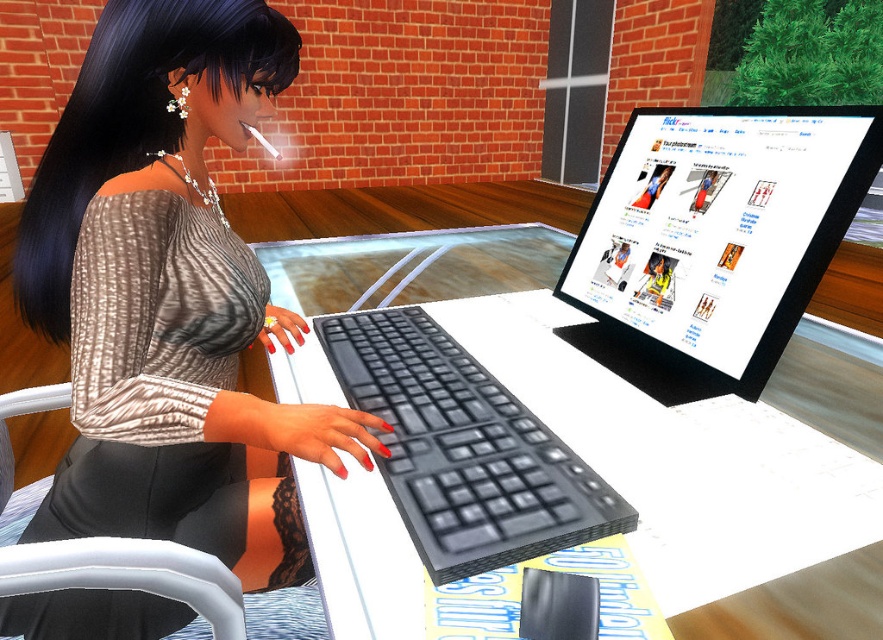
You are a character in the scene and want to place a small object on the desk between the matte black dress at center and the matte black monitor at upper right. Is there enough space between them to place the object?

The matte black dress at center is located below the matte black monitor at upper right, so there is vertical space between them. However, since the objects are positioned vertically, placing a small object between them on the desk might not be feasible as they are aligned along different axes. Consider checking the horizontal space instead.

What are the coordinates of the black plastic keyboard at center?

The black plastic keyboard at center is located at coordinates point (x=713, y=241).